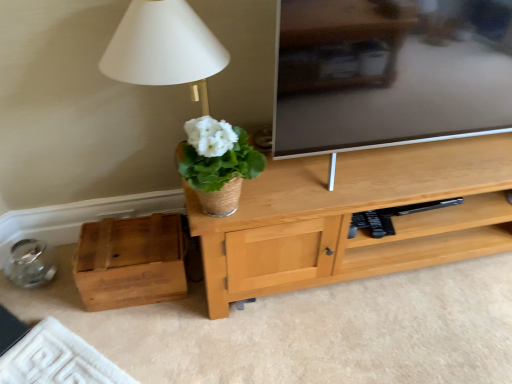
You are a GUI agent. You are given a task and a screenshot of the screen. Output one action in this format:
    pyautogui.click(x=<x>, y=<y>)
    Task: Click on the unoccupied area in front of wooden box at lower left
    The height and width of the screenshot is (384, 512).
    Given the screenshot: What is the action you would take?
    pyautogui.click(x=144, y=336)